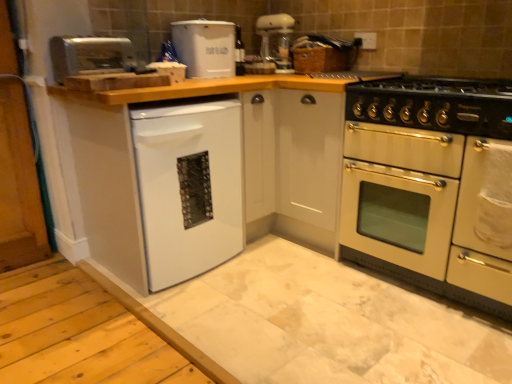
Question: Considering the positions of black enamel gas stove at right and white matte dishwasher at lower left in the image, is black enamel gas stove at right taller or shorter than white matte dishwasher at lower left?

Choices:
 (A) tall
 (B) short

Answer: (B)

Question: Choose the correct answer: Is black enamel gas stove at right inside white matte dishwasher at lower left or outside it?

Choices:
 (A) inside
 (B) outside

Answer: (B)

Question: Which object is positioned closest to the satin silver toaster at upper left, which ranks as the 2th appliance in right-to-left order?

Choices:
 (A) white glossy dishwasher at lower left
 (B) white matte dishwasher at lower left
 (C) black enamel gas stove at right
 (D) matte white coffee machine at upper center
 (E) white plastic bread bin at upper center, marked as the first appliance in a back-to-front arrangement

Answer: (E)

Question: Which is farther from the satin silver toaster at upper left, which ranks as the 2th appliance in right-to-left order?

Choices:
 (A) white matte dishwasher at lower left
 (B) white plastic bread bin at upper center, which appears as the second appliance when viewed from the front
 (C) matte white coffee machine at upper center
 (D) white glossy dishwasher at lower left
 (E) black enamel gas stove at right

Answer: (E)